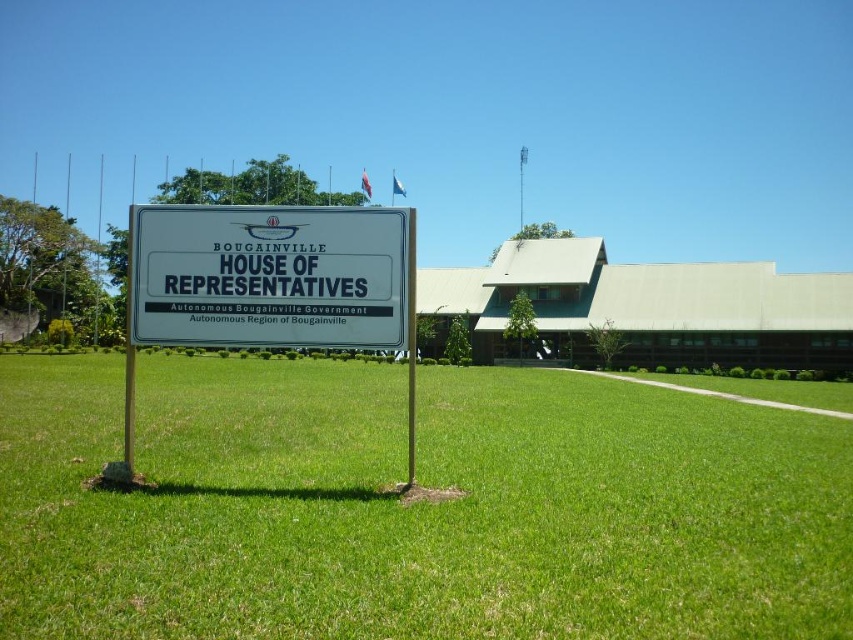
Who is lower down, green grass at center or white plastic sign at center?

Positioned lower is green grass at center.

Who is more forward, (132,508) or (300,308)?

Point (132,508) is in front.

You are a GUI agent. You are given a task and a screenshot of the screen. Output one action in this format:
    pyautogui.click(x=<x>, y=<y>)
    Task: Click on the green grass at center
    
    Given the screenshot: What is the action you would take?
    pyautogui.click(x=413, y=506)